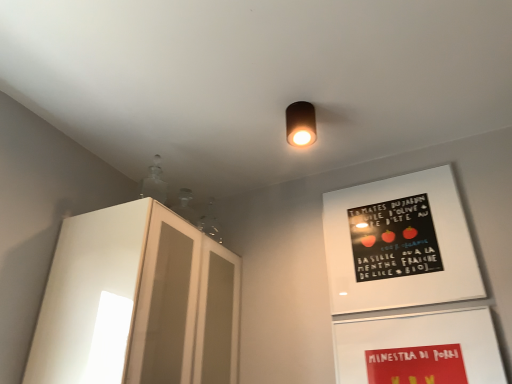
Question: Can you confirm if white glossy cabinet at left is shorter than matte white bulletin board at lower right, which appears as the 1th bulletin board when ordered from the bottom?

Choices:
 (A) yes
 (B) no

Answer: (B)

Question: Would you say white glossy cabinet at left is a long distance from matte white bulletin board at lower right, the second bulletin board viewed from the top?

Choices:
 (A) yes
 (B) no

Answer: (B)

Question: Is white glossy cabinet at left bigger than matte white bulletin board at lower right, the second bulletin board viewed from the top?

Choices:
 (A) no
 (B) yes

Answer: (B)

Question: Is white glossy cabinet at left located outside matte white bulletin board at lower right, the second bulletin board viewed from the top?

Choices:
 (A) no
 (B) yes

Answer: (B)

Question: Does white glossy cabinet at left appear on the left side of matte white bulletin board at lower right, which appears as the 1th bulletin board when ordered from the bottom?

Choices:
 (A) yes
 (B) no

Answer: (A)

Question: Is matte white bulletin board at lower right, which appears as the 1th bulletin board when ordered from the bottom, located within white glossy cabinet at left?

Choices:
 (A) no
 (B) yes

Answer: (A)

Question: From a real-world perspective, is matte black cylinder at center on matte white bulletin board at lower right, which appears as the 1th bulletin board when ordered from the bottom?

Choices:
 (A) no
 (B) yes

Answer: (B)

Question: Is the depth of matte black cylinder at center greater than that of matte white bulletin board at lower right, the second bulletin board viewed from the top?

Choices:
 (A) yes
 (B) no

Answer: (A)

Question: From the image's perspective, would you say matte black cylinder at center is positioned over matte white bulletin board at lower right, the second bulletin board viewed from the top?

Choices:
 (A) yes
 (B) no

Answer: (A)

Question: Would you say matte black cylinder at center is outside matte white bulletin board at lower right, which appears as the 1th bulletin board when ordered from the bottom?

Choices:
 (A) yes
 (B) no

Answer: (A)

Question: Is matte black cylinder at center to the right of matte white bulletin board at lower right, the second bulletin board viewed from the top, from the viewer's perspective?

Choices:
 (A) no
 (B) yes

Answer: (A)

Question: Is matte black cylinder at center not close to matte white bulletin board at lower right, the second bulletin board viewed from the top?

Choices:
 (A) yes
 (B) no

Answer: (B)

Question: From the image's perspective, would you say matte white bulletin board at lower right, the second bulletin board viewed from the top, is positioned over white glossy cabinet at left?

Choices:
 (A) yes
 (B) no

Answer: (B)